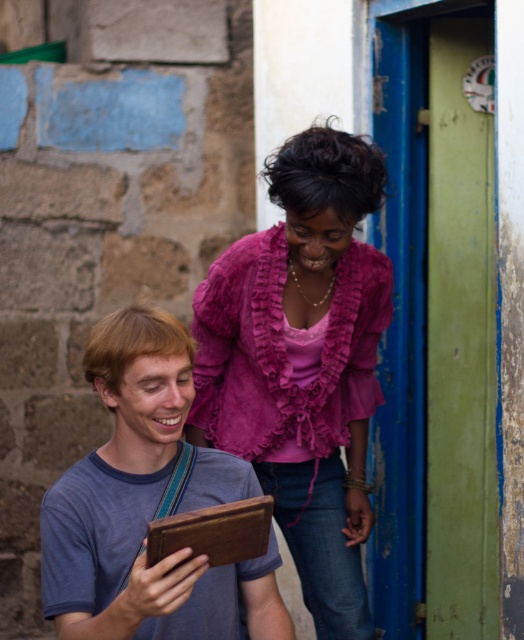
Is the position of pink ruffled blouse at center less distant than that of matte brown tablet at lower left?

No, it is not.

Who is more distant from viewer, [290,152] or [161,380]?

The point [290,152] is more distant.

The height and width of the screenshot is (640, 524). In order to click on pink ruffled blouse at center in this screenshot , I will do `click(302, 362)`.